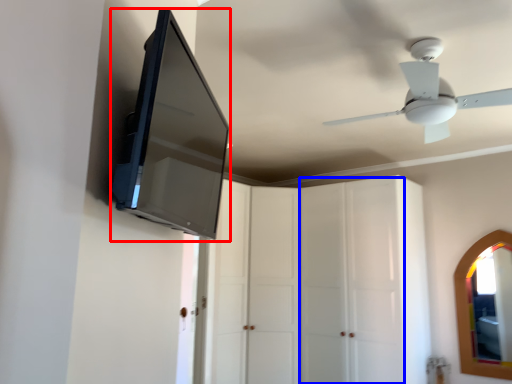
Question: Which object is closer to the camera taking this photo, medicine cabinet (highlighted by a red box) or glass door (highlighted by a blue box)?

Choices:
 (A) medicine cabinet
 (B) glass door

Answer: (A)